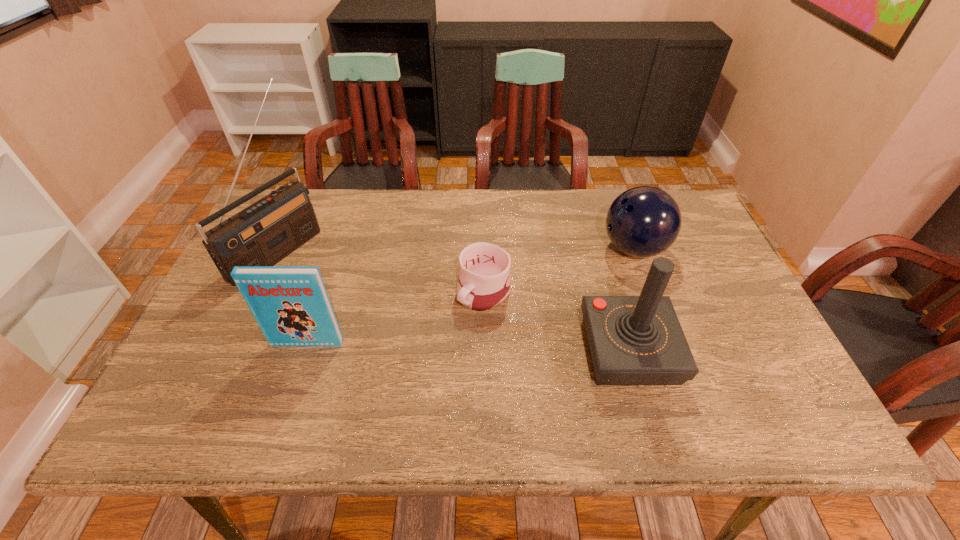
Where is `vacant point located on the surface of the fourth tallest object near the finger holes`? vacant point located on the surface of the fourth tallest object near the finger holes is located at coordinates (587, 271).

What are the coordinates of `free space located 0.220m on the surface of the fourth tallest object near the finger holes` in the screenshot? It's located at (546, 291).

Identify the location of free space located 0.260m on the side with the handle of the third object from left to right. (389, 380).

The width and height of the screenshot is (960, 540). What are the coordinates of `free point located on the side with the handle of the third object from left to right` in the screenshot? It's located at (402, 368).

Where is `vacant position located 0.050m on the side with the handle of the third object from left to right`? vacant position located 0.050m on the side with the handle of the third object from left to right is located at coordinates (453, 323).

Locate an element on the screen. radio receiver situated at the far edge is located at coordinates (264, 233).

What are the coordinates of `bowling ball present at the far edge` in the screenshot? It's located at (644, 221).

Find the location of a particular element. object that is at the near edge is located at coordinates (633, 340).

In order to click on object at the left edge in this screenshot , I will do `click(264, 233)`.

You are a GUI agent. You are given a task and a screenshot of the screen. Output one action in this format:
    pyautogui.click(x=<x>, y=<y>)
    Task: Click on the object located in the right edge section of the desktop
    The height and width of the screenshot is (540, 960).
    Given the screenshot: What is the action you would take?
    pyautogui.click(x=644, y=221)